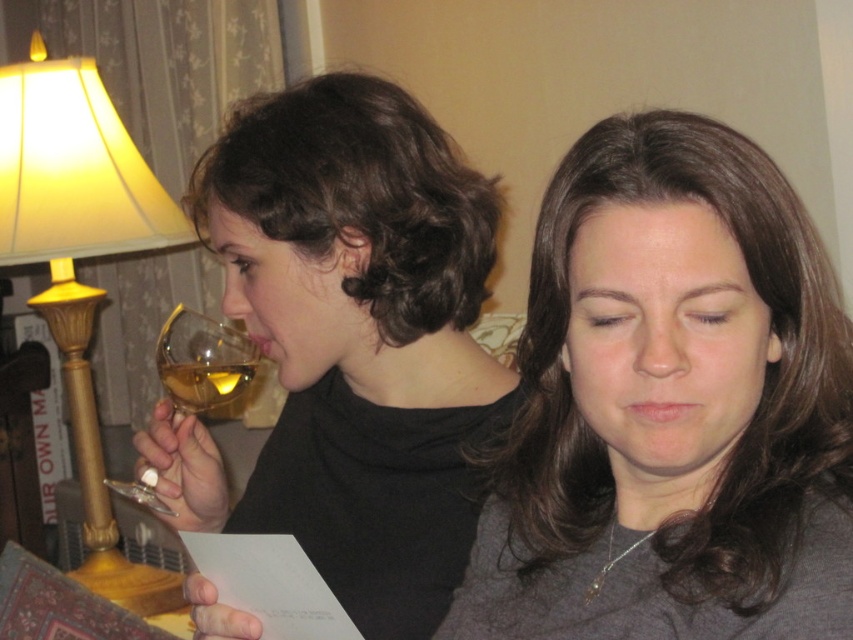
Can you confirm if dark brown hair at left is positioned to the right of gold metallic lampshade at left?

Correct, you'll find dark brown hair at left to the right of gold metallic lampshade at left.

Is dark brown hair at left in front of gold metallic lampshade at left?

Yes.

You are a GUI agent. You are given a task and a screenshot of the screen. Output one action in this format:
    pyautogui.click(x=<x>, y=<y>)
    Task: Click on the dark brown hair at left
    
    Given the screenshot: What is the action you would take?
    pyautogui.click(x=358, y=195)

Does point (529, 320) lie behind point (109, 506)?

No, (529, 320) is closer to viewer.

Describe the element at coordinates (764, 380) in the screenshot. This screenshot has width=853, height=640. I see `smooth brown hair at center` at that location.

You are a GUI agent. You are given a task and a screenshot of the screen. Output one action in this format:
    pyautogui.click(x=<x>, y=<y>)
    Task: Click on the smooth brown hair at center
    
    Given the screenshot: What is the action you would take?
    pyautogui.click(x=764, y=380)

Is smooth brown hair at center below translucent glass wine glass at left?

No, smooth brown hair at center is not below translucent glass wine glass at left.

Who is taller, smooth brown hair at center or translucent glass wine glass at left?

smooth brown hair at center is taller.

Between point (583, 492) and point (206, 390), which one is positioned behind?

Point (206, 390)

The height and width of the screenshot is (640, 853). What are the coordinates of `smooth brown hair at center` in the screenshot? It's located at point(764,380).